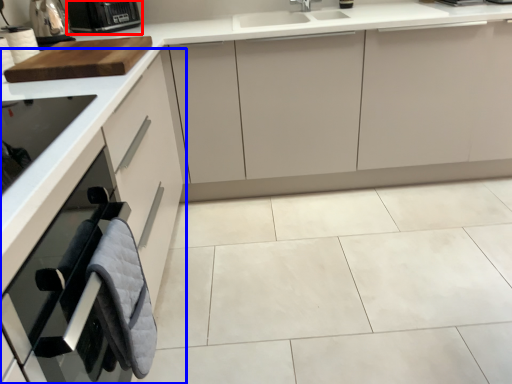
Question: Which point is further to the camera, kitchen appliance (highlighted by a red box) or cabinetry (highlighted by a blue box)?

Choices:
 (A) kitchen appliance
 (B) cabinetry

Answer: (A)